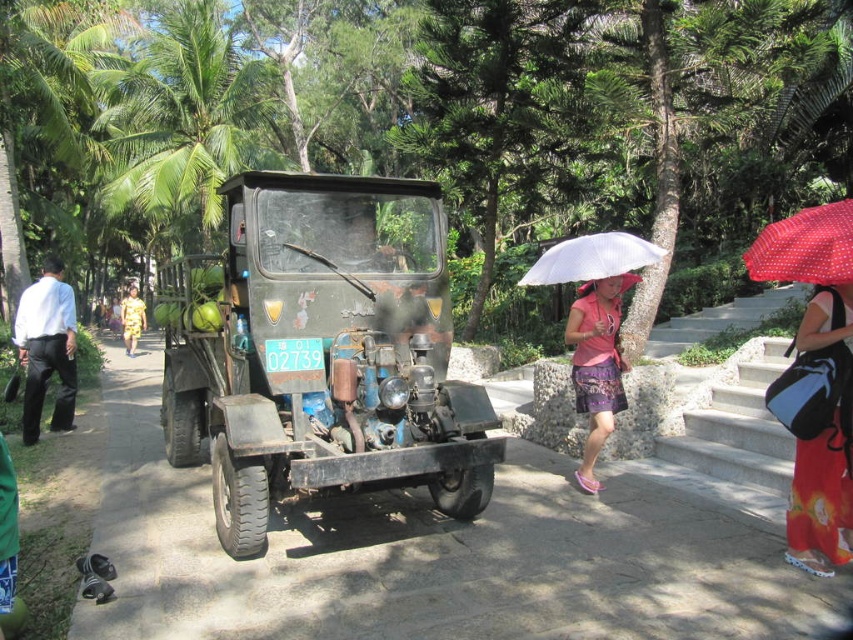
Question: Based on their relative distances, which object is farther from the red dotted fabric umbrella at upper right?

Choices:
 (A) rusty metal truck at center
 (B) floral cotton skirt at lower right

Answer: (A)

Question: Can you confirm if rusty metal truck at center is thinner than floral cotton skirt at lower right?

Choices:
 (A) no
 (B) yes

Answer: (A)

Question: Among these objects, which one is nearest to the camera?

Choices:
 (A) green leafy palm tree at upper left
 (B) white matte umbrella at center
 (C) white shirt at left

Answer: (B)

Question: Among these objects, which one is nearest to the camera?

Choices:
 (A) floral cotton skirt at lower right
 (B) pink fabric skirt at lower center

Answer: (A)

Question: Is rusty metal truck at center to the right of yellow floral dress at center from the viewer's perspective?

Choices:
 (A) yes
 (B) no

Answer: (A)

Question: Does red dotted fabric umbrella at upper right appear under yellow floral dress at center?

Choices:
 (A) yes
 (B) no

Answer: (B)